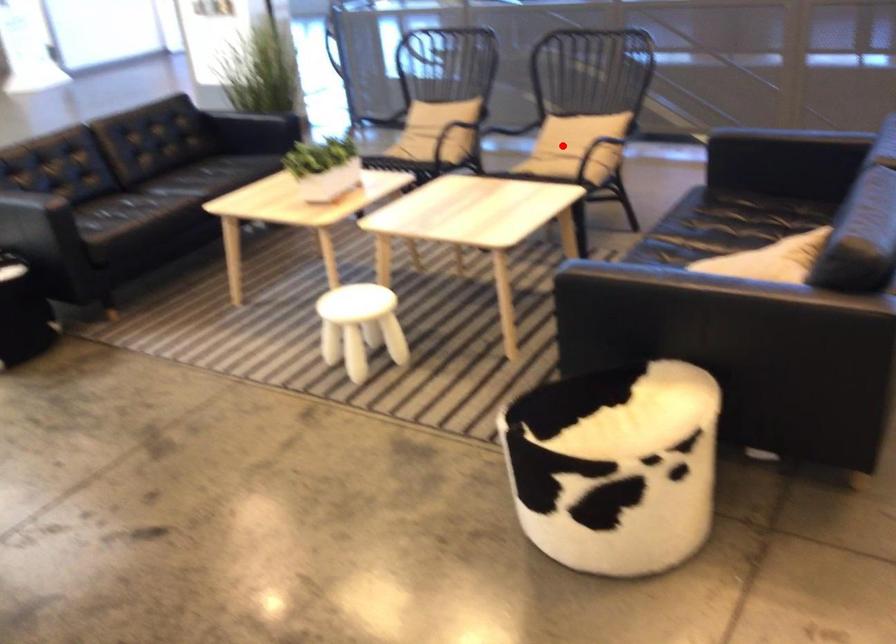
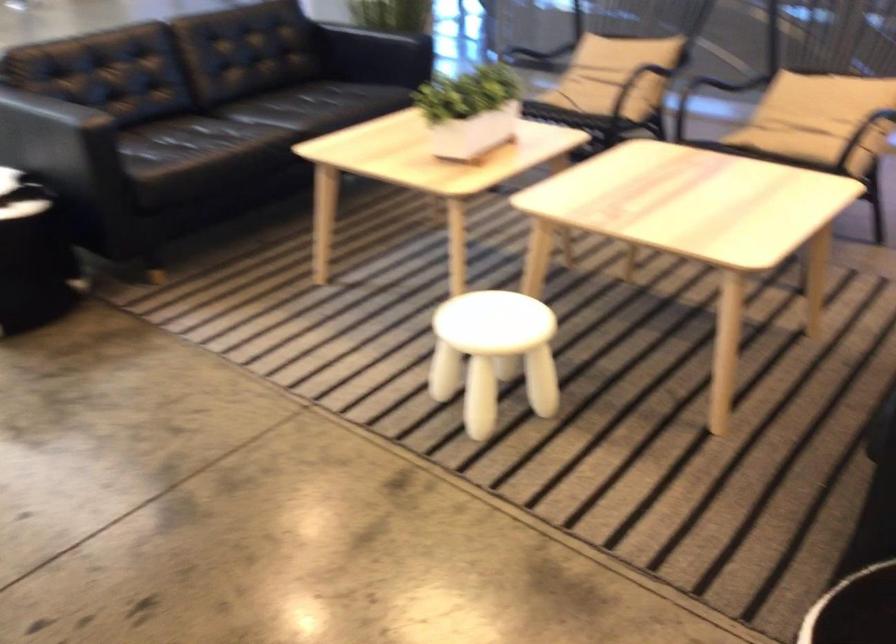
Locate, in the second image, the point that corresponds to the highlighted location in the first image.

(817, 118)